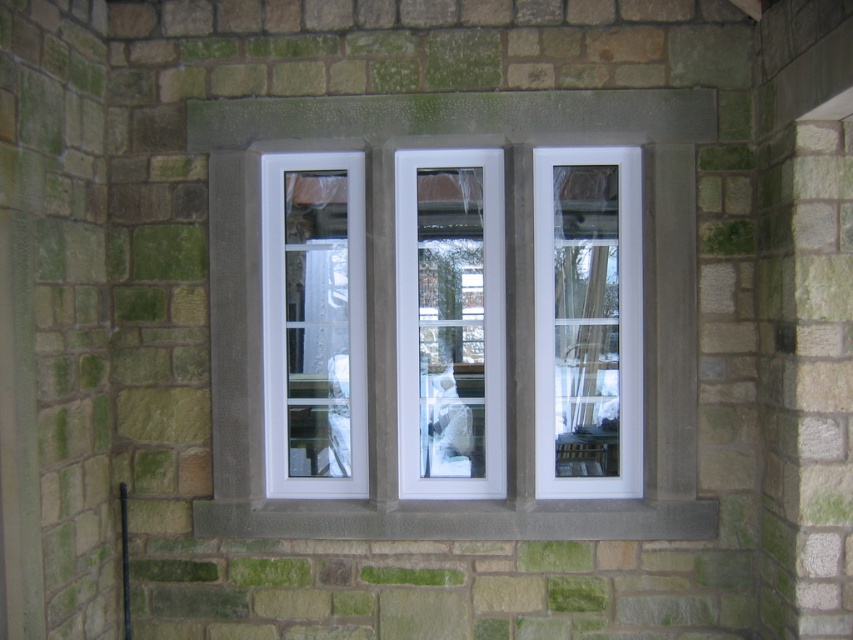
Which is more to the right, white glass door at center or gray stone window sill at center?

gray stone window sill at center

Measure the distance between white glass door at center and camera.

white glass door at center is 14.98 feet from camera.

Who is more distant from viewer, (461, 280) or (434, 513)?

Positioned behind is point (461, 280).

Find the location of a particular element. The width and height of the screenshot is (853, 640). white glass door at center is located at coordinates (450, 323).

Is point (373, 419) behind point (637, 202)?

That is False.

Who is more distant from viewer, (392,161) or (608,420)?

Point (608,420)

Image resolution: width=853 pixels, height=640 pixels. What are the coordinates of `white plastic windows at center` in the screenshot? It's located at (509, 298).

Which is more to the left, white glossy glass door at center or gray stone window sill at center?

gray stone window sill at center is more to the left.

Between white glossy glass door at center and gray stone window sill at center, which one is positioned higher?

white glossy glass door at center

Is point (595, 180) less distant than point (428, 518)?

No, it is not.

Locate an element on the screen. This screenshot has height=640, width=853. white glossy glass door at center is located at coordinates (587, 323).